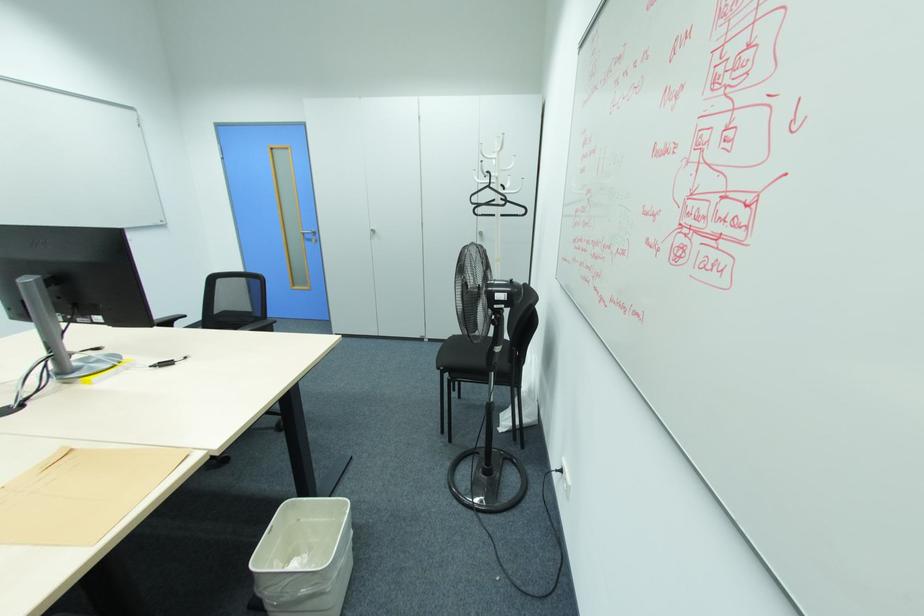
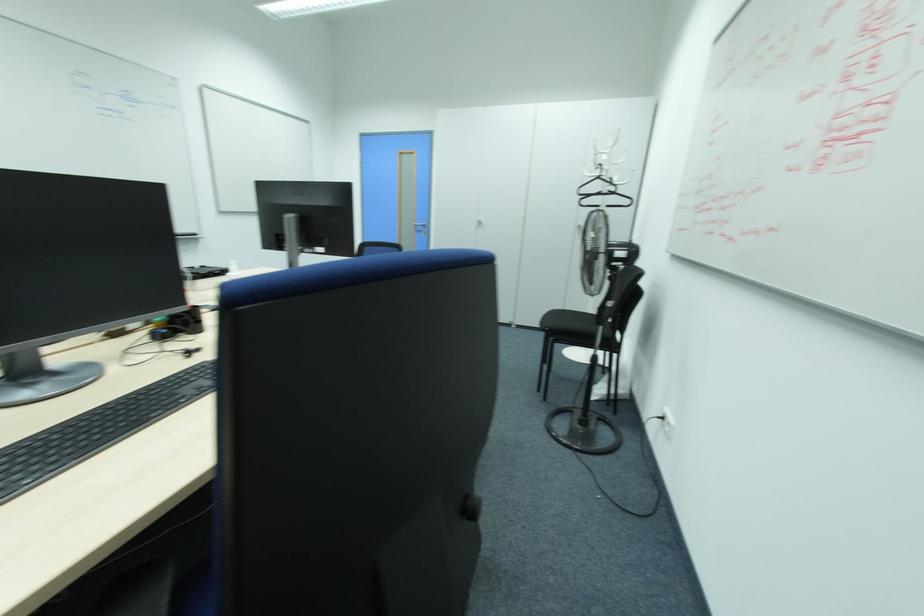
Question: The camera is either moving clockwise (left) or counter-clockwise (right) around the object. The first image is from the beginning of the video and the second image is from the end. Is the camera moving left or right when shooting the video?

Choices:
 (A) Left
 (B) Right

Answer: (B)